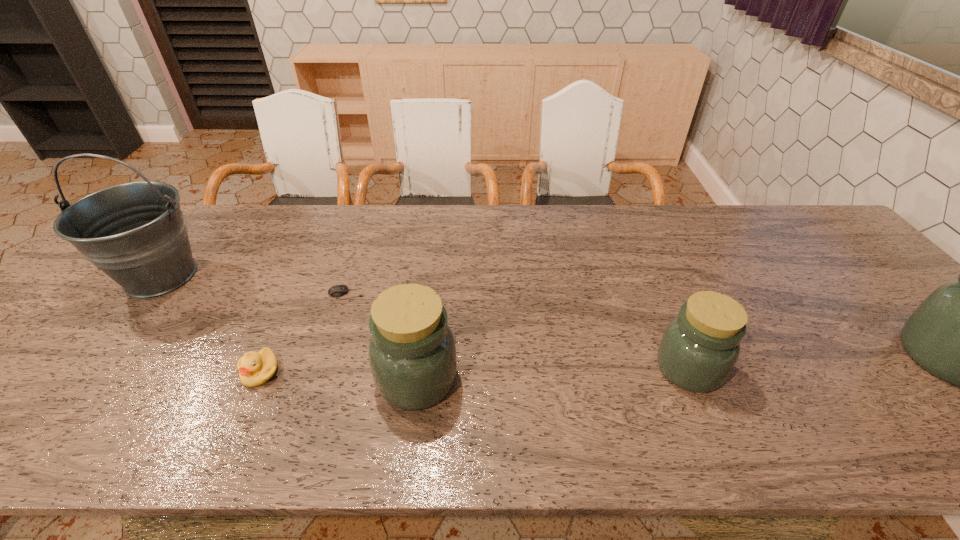
Locate an element on the screen. the leftmost jar is located at coordinates (412, 353).

Where is `the fourth object from left to right`? The image size is (960, 540). the fourth object from left to right is located at coordinates (412, 353).

The height and width of the screenshot is (540, 960). In order to click on the fifth object from left to right in this screenshot , I will do `click(700, 347)`.

This screenshot has width=960, height=540. I want to click on the shortest jar, so click(700, 347).

The image size is (960, 540). In order to click on the shortest object in this screenshot , I will do pos(338,290).

Identify the location of mouse. (338, 290).

Locate an element on the screen. This screenshot has width=960, height=540. bucket is located at coordinates (135, 232).

You are a GUI agent. You are given a task and a screenshot of the screen. Output one action in this format:
    pyautogui.click(x=<x>, y=<y>)
    Task: Click on the leftmost object
    Image resolution: width=960 pixels, height=540 pixels.
    Given the screenshot: What is the action you would take?
    pyautogui.click(x=135, y=232)

The width and height of the screenshot is (960, 540). Identify the location of the second shortest object. (255, 368).

This screenshot has width=960, height=540. Identify the location of duckling. (255, 368).